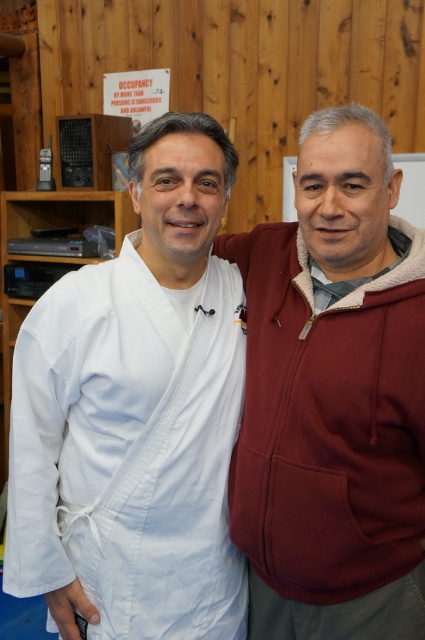
You are a delivery person who needs to place a package that is 1.2 meters long between the maroon fleece jacket at right and the matte wood bulletin board at upper center. Can you fit the package between them without bending it?

The distance between the maroon fleece jacket at right and the matte wood bulletin board at upper center is 1.05 meters. Since the package is 1.2 meters long, it cannot fit straight between them without bending.

You are a photographer setting up for a photoshoot in this scene. You need to position a spotlight so it illuminates both the maroon fleece jacket at right and the white cotton lab coat at left. Since the spotlight can only be placed to the side, which side should you place it to ensure both are lit evenly?

The maroon fleece jacket at right is positioned on the right side of the white cotton lab coat at left. To evenly illuminate both, place the spotlight to the back of the scene so that light reaches both objects from behind, avoiding shadows cast by their positions.

You are a visitor in a medical facility and need to locate the emergency exit sign. You see the white cotton lab coat at left and the matte wood bulletin board at upper center. Which object is nearer to you?

The white cotton lab coat at left is closer to the viewer than the matte wood bulletin board at upper center.